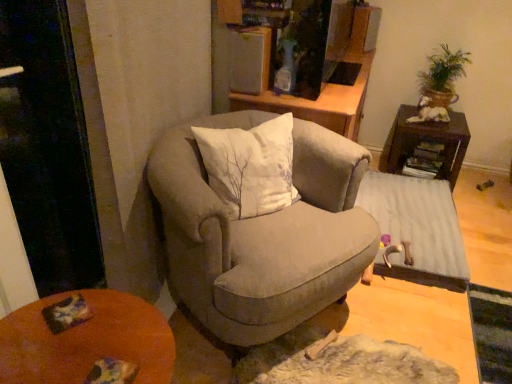
Find the location of a particular element. The image size is (512, 384). free region under white ceramic dog at upper right (from a real-world perspective) is located at coordinates point(423,119).